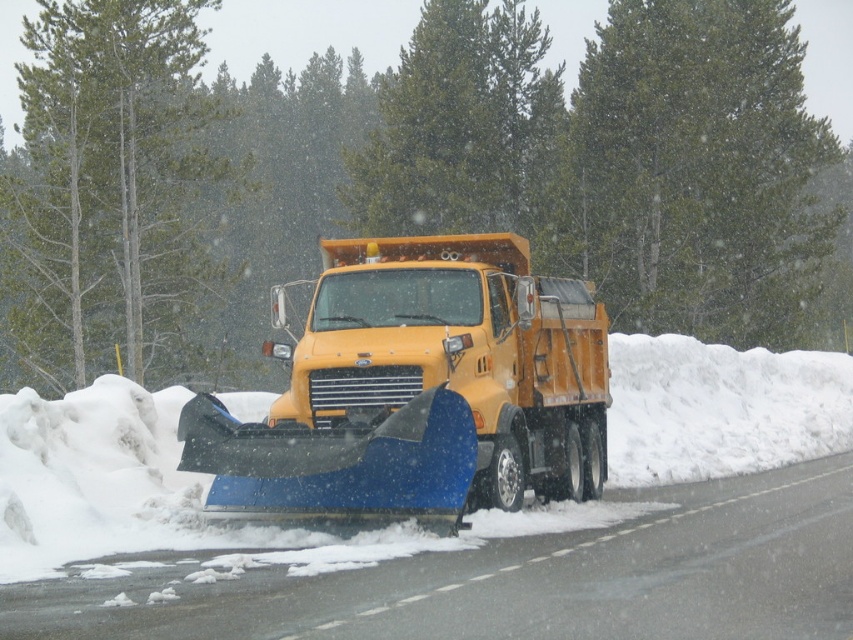
You are a delivery driver navigating through the snowstorm. You need to reach a destination located near the green leafy tree at upper center. Based on the truck positioning, which direction should you drive relative to the yellow snowplow truck on the right side of the road?

Since the yellow snowplow truck is on the right side of the road facing left, you should drive to the left of the truck to head towards the green leafy tree at upper center.

You are a pedestrian standing on the sidewalk and see the yellow matte truck at center and the green textured tree at center. Which object is closer to you?

The yellow matte truck at center is closer to you than the green textured tree at center.